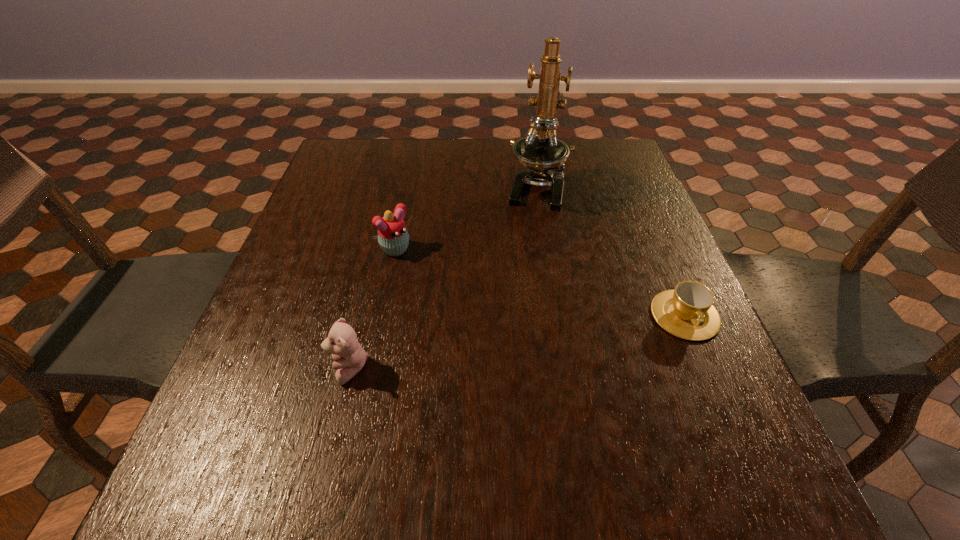
This screenshot has width=960, height=540. Find the location of `vacant space at the left edge of the desktop`. vacant space at the left edge of the desktop is located at coordinates (310, 215).

This screenshot has width=960, height=540. In the image, there is a desktop. Identify the location of free space at the right edge. (643, 317).

Locate an element on the screen. This screenshot has width=960, height=540. free location at the far left corner is located at coordinates 373,180.

Identify the location of vacant space at the near right corner. This screenshot has height=540, width=960. (749, 435).

Find the location of a particular element. free spot between the microscope and the cup is located at coordinates (611, 252).

Find the location of a particular element. The image size is (960, 540). free area in between the third object from left to right and the second farthest object is located at coordinates (468, 220).

This screenshot has width=960, height=540. I want to click on empty space that is in between the tallest object and the teddy bear, so click(443, 279).

The height and width of the screenshot is (540, 960). I want to click on free space between the cupcake and the rightmost object, so click(541, 283).

In order to click on free space between the cup and the second object from right to left in this screenshot , I will do `click(611, 252)`.

This screenshot has height=540, width=960. In order to click on unoccupied position between the teddy bear and the second farthest object in this screenshot , I will do `click(373, 310)`.